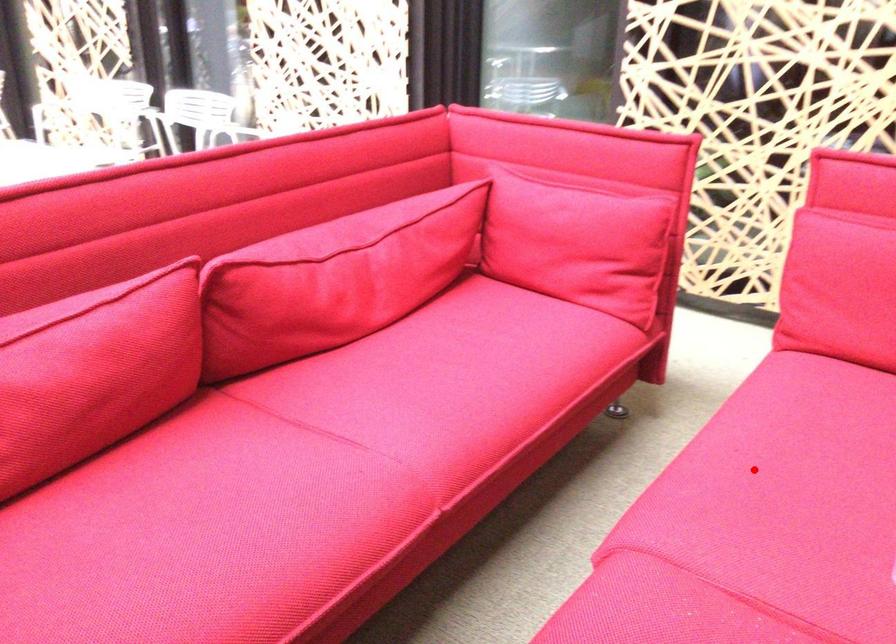
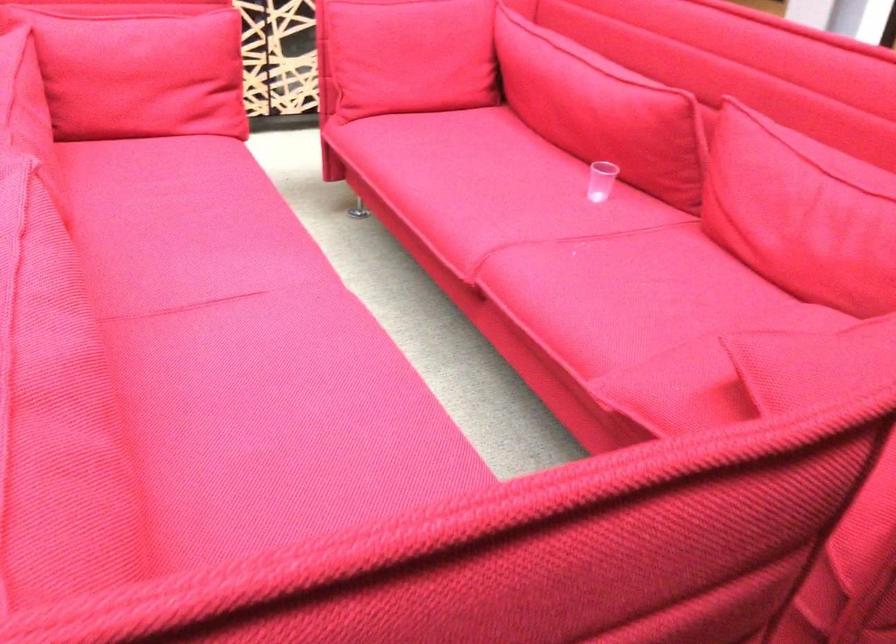
Question: I am providing you with two images of the same scene from different viewpoints. A red point is shown in image1. For the corresponding object point in image2, is it positioned nearer or farther from the camera?

Choices:
 (A) Nearer
 (B) Farther

Answer: (B)